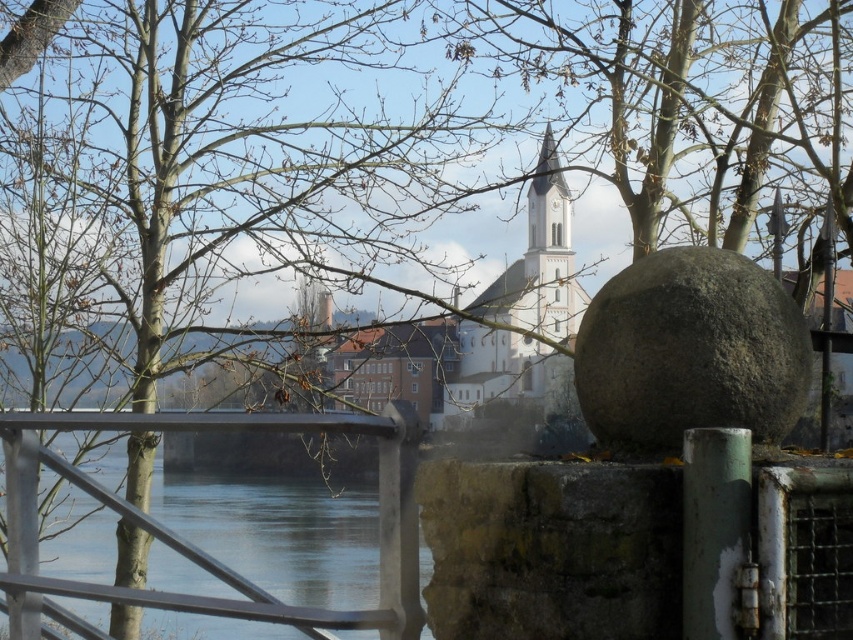
Does smooth concrete river at center have a lesser height compared to white stone tower at center?

Indeed, smooth concrete river at center has a lesser height compared to white stone tower at center.

Which is in front, point (15, 577) or point (531, 356)?

Point (15, 577)

Identify the location of smooth concrete river at center. (199, 548).

Is gray rough stone sphere at center positioned at the back of white stone tower at center?

No, gray rough stone sphere at center is in front of white stone tower at center.

Which of these two, gray rough stone sphere at center or white stone tower at center, stands taller?

white stone tower at center is taller.

Which is in front, point (735, 422) or point (560, 241)?

Point (735, 422) is more forward.

The height and width of the screenshot is (640, 853). I want to click on gray rough stone sphere at center, so click(x=689, y=353).

Is gray rough stone sphere at center positioned before brown leafless tree at upper left?

No.

In the scene shown: Who is more forward, (677, 317) or (102, 412)?

Point (677, 317) is in front.

This screenshot has height=640, width=853. Find the location of `gray rough stone sphere at center`. gray rough stone sphere at center is located at coordinates (689, 353).